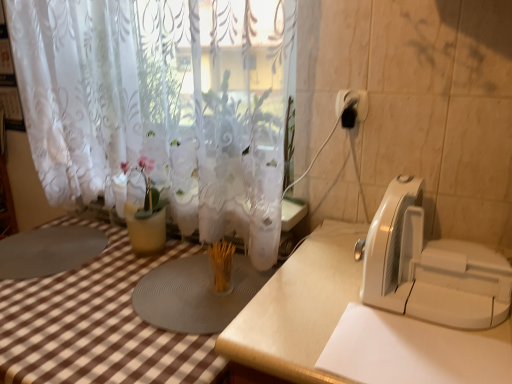
You are a GUI agent. You are given a task and a screenshot of the screen. Output one action in this format:
    pyautogui.click(x=<x>, y=<y>)
    Task: Click on the free location to the left of white plastic appliance at right
    The height and width of the screenshot is (384, 512).
    Given the screenshot: What is the action you would take?
    pyautogui.click(x=317, y=298)